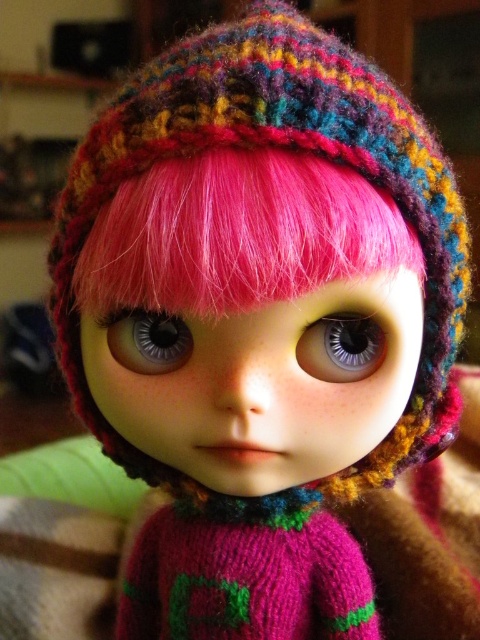
Between point (356, 369) and point (186, 339), which one is positioned behind?

The point (186, 339) is behind.

Looking at this image, is gray matte eye at center behind shiny plastic eye at center?

No, gray matte eye at center is in front of shiny plastic eye at center.

Identify the location of gray matte eye at center. (342, 348).

Locate an element on the screen. This screenshot has height=640, width=480. gray matte eye at center is located at coordinates (342, 348).

What do you see at coordinates (237, 234) in the screenshot? This screenshot has width=480, height=640. I see `pink woolen hair at center` at bounding box center [237, 234].

Who is more forward, [224,269] or [134,364]?

Point [224,269] is in front.

Where is `pink woolen hair at center`? pink woolen hair at center is located at coordinates (237, 234).

Looking at this image, can you confirm if pink woolen hair at center is bigger than gray matte eye at center?

Yes, pink woolen hair at center is bigger than gray matte eye at center.

Does pink woolen hair at center have a lesser width compared to gray matte eye at center?

No, pink woolen hair at center is not thinner than gray matte eye at center.

This screenshot has width=480, height=640. Find the location of `pink woolen hair at center`. pink woolen hair at center is located at coordinates (237, 234).

You are a GUI agent. You are given a task and a screenshot of the screen. Output one action in this format:
    pyautogui.click(x=<x>, y=<y>)
    Task: Click on the pink woolen hair at center
    The width and height of the screenshot is (480, 640).
    Given the screenshot: What is the action you would take?
    pyautogui.click(x=237, y=234)